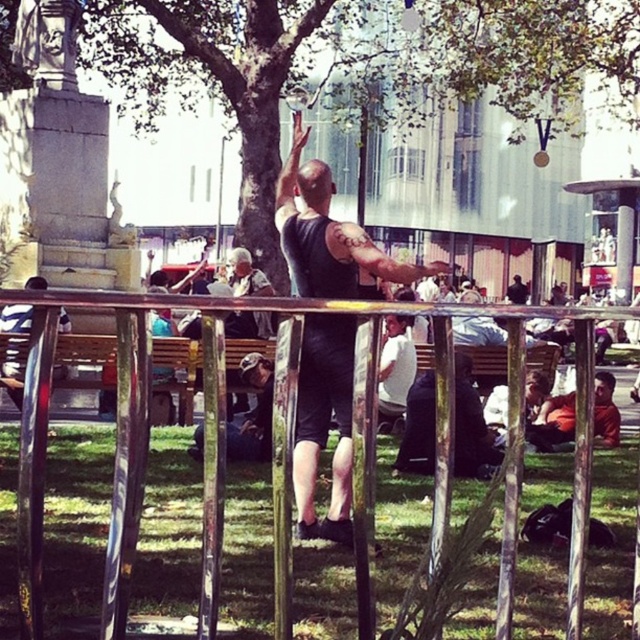
Question: Based on their relative distances, which object is farther from the metallic silver fence at center?

Choices:
 (A) black matte tank top at center
 (B) metallic silver pole at left

Answer: (B)

Question: Does green leafy tree at center have a larger size compared to black matte tank top at center?

Choices:
 (A) no
 (B) yes

Answer: (B)

Question: Is black matte tank top at center bigger than metallic silver pole at left?

Choices:
 (A) no
 (B) yes

Answer: (B)

Question: Among these objects, which one is nearest to the camera?

Choices:
 (A) metallic silver pole at left
 (B) black matte tank top at center

Answer: (A)

Question: Is green leafy tree at center closer to camera compared to metallic silver fence at center?

Choices:
 (A) yes
 (B) no

Answer: (B)

Question: Which object is closer to the camera taking this photo?

Choices:
 (A) metallic silver pole at left
 (B) metallic silver fence at center

Answer: (B)